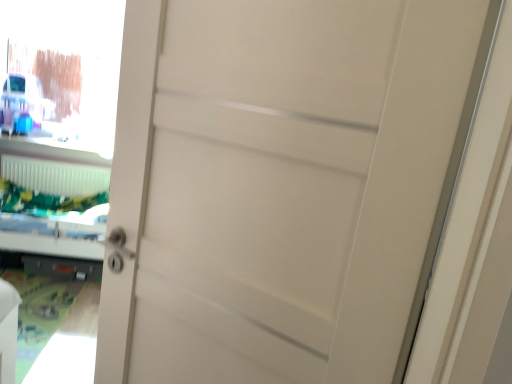
Where is `free spot above white plastic radiator at lower left (from a real-world perspective)`? This screenshot has height=384, width=512. free spot above white plastic radiator at lower left (from a real-world perspective) is located at coordinates (49, 159).